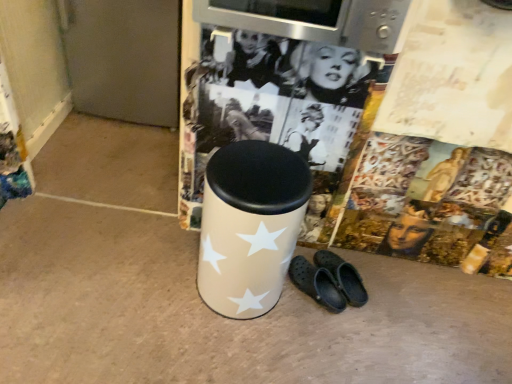
Question: Is point (342, 266) closer or farther from the camera than point (252, 246)?

Choices:
 (A) farther
 (B) closer

Answer: (A)

Question: In the image, is black rubber crocs at lower center positioned in front of or behind beige fabric waste bin at center?

Choices:
 (A) behind
 (B) front

Answer: (A)

Question: Is black rubber crocs at lower center wider or thinner than beige fabric waste bin at center?

Choices:
 (A) wide
 (B) thin

Answer: (B)

Question: From the image's perspective, relative to black rubber crocs at lower center, is beige fabric waste bin at center above or below?

Choices:
 (A) below
 (B) above

Answer: (B)

Question: Looking at the image, does beige fabric waste bin at center seem bigger or smaller compared to black rubber crocs at lower center?

Choices:
 (A) small
 (B) big

Answer: (B)

Question: Considering the positions of beige fabric waste bin at center and black rubber crocs at lower center in the image, is beige fabric waste bin at center wider or thinner than black rubber crocs at lower center?

Choices:
 (A) wide
 (B) thin

Answer: (A)

Question: Considering the positions of beige fabric waste bin at center and black rubber crocs at lower center in the image, is beige fabric waste bin at center taller or shorter than black rubber crocs at lower center?

Choices:
 (A) short
 (B) tall

Answer: (B)